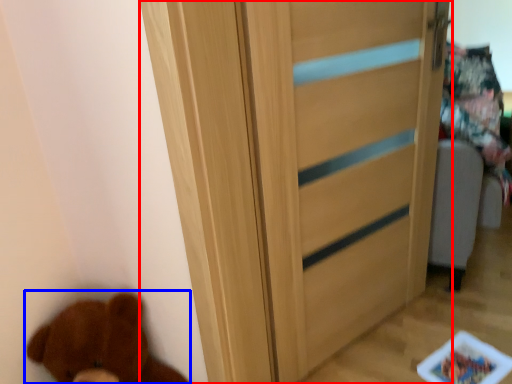
Question: Which object is further to the camera taking this photo, door (highlighted by a red box) or brown bear (highlighted by a blue box)?

Choices:
 (A) door
 (B) brown bear

Answer: (A)